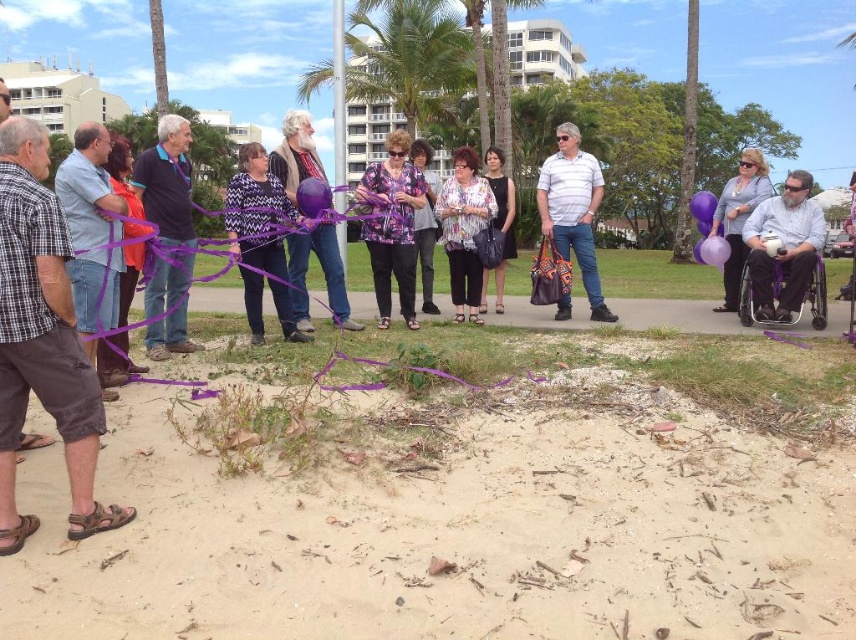
Does matte blue shirt at left have a larger size compared to purple printed blouse at center?

Indeed, matte blue shirt at left has a larger size compared to purple printed blouse at center.

Is matte blue shirt at left to the left of purple printed blouse at center from the viewer's perspective?

Indeed, matte blue shirt at left is positioned on the left side of purple printed blouse at center.

Is point (100, 141) positioned before point (420, 253)?

Yes, point (100, 141) is closer to viewer.

This screenshot has height=640, width=856. Identify the location of matte blue shirt at left. (91, 232).

Does purple fabric at center have a greater width compared to metallic purple wheelchair at right?

Correct, the width of purple fabric at center exceeds that of metallic purple wheelchair at right.

Image resolution: width=856 pixels, height=640 pixels. Identify the location of purple fabric at center. (167, 182).

Between metallic purple wheelchair at right and matte purple scarf at left, which one is positioned higher?

matte purple scarf at left is above.

The height and width of the screenshot is (640, 856). Identify the location of metallic purple wheelchair at right. (782, 288).

Locate an element on the screen. metallic purple wheelchair at right is located at coordinates pyautogui.click(x=782, y=288).

At what (x,y) coordinates should I click in order to perform the action: click on metallic purple wheelchair at right. Please return your answer as a coordinate pair (x, y). Looking at the image, I should click on (782, 288).